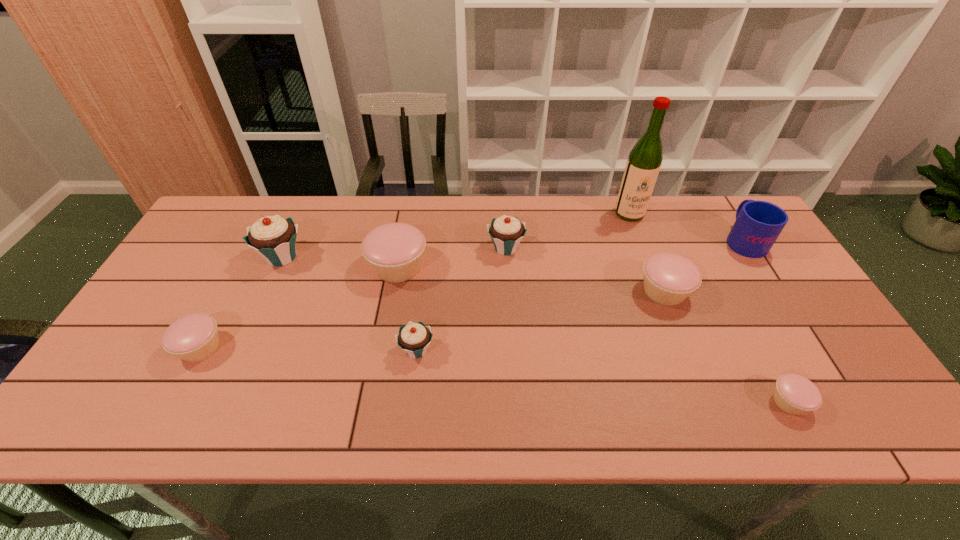
Locate which cupcake ranks second in proximity to the biggest pink cupcake. Please provide its 2D coordinates. Your answer should be formatted as a tuple, i.e. [(x, y)], where the tuple contains the x and y coordinates of a point satisfying the conditions above.

[(506, 232)]

Point out which cupcake is positioned as the nearest to the biggest teal cupcake. Please provide its 2D coordinates. Your answer should be formatted as a tuple, i.e. [(x, y)], where the tuple contains the x and y coordinates of a point satisfying the conditions above.

[(394, 251)]

Image resolution: width=960 pixels, height=540 pixels. What are the coordinates of `the third closest teal cupcake to the green liquor` in the screenshot? It's located at (273, 237).

Where is `the closest teal cupcake to the third smallest pink cupcake`? the closest teal cupcake to the third smallest pink cupcake is located at coordinates coord(506,232).

At what (x,y) coordinates should I click in order to perform the action: click on pink cupcake that is the closest one to the second teal cupcake from left to right. Please return your answer as a coordinate pair (x, y). This screenshot has height=540, width=960. Looking at the image, I should click on (394, 251).

What are the coordinates of `pink cupcake that stands as the second closest to the tallest cupcake` in the screenshot? It's located at (194, 337).

The height and width of the screenshot is (540, 960). In order to click on vacant area that satisfies the following two spatial constraints: 1. on the front side of the second nearest pink cupcake; 2. on the left side of the nearest pink cupcake in this screenshot , I will do `click(172, 402)`.

You are a GUI agent. You are given a task and a screenshot of the screen. Output one action in this format:
    pyautogui.click(x=<x>, y=<y>)
    Task: Click on the vacant space that satisfies the following two spatial constraints: 1. on the label of the nearest pink cupcake; 2. on the left side of the green liquor
    Image resolution: width=960 pixels, height=540 pixels.
    Given the screenshot: What is the action you would take?
    click(x=701, y=402)

Where is `free location that satisfies the following two spatial constraints: 1. on the back side of the nearest teal cupcake; 2. on the left side of the second biggest pink cupcake`? free location that satisfies the following two spatial constraints: 1. on the back side of the nearest teal cupcake; 2. on the left side of the second biggest pink cupcake is located at coordinates (423, 291).